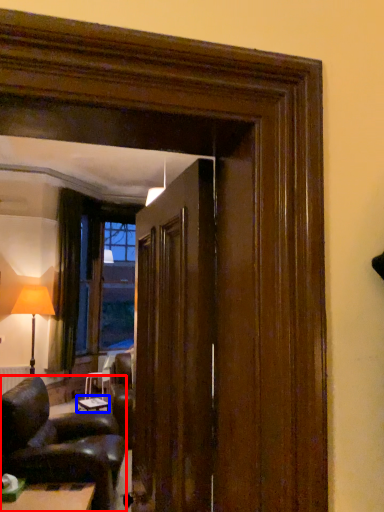
Question: Which object is closer to the camera taking this photo, chair (highlighted by a red box) or table (highlighted by a blue box)?

Choices:
 (A) chair
 (B) table

Answer: (A)